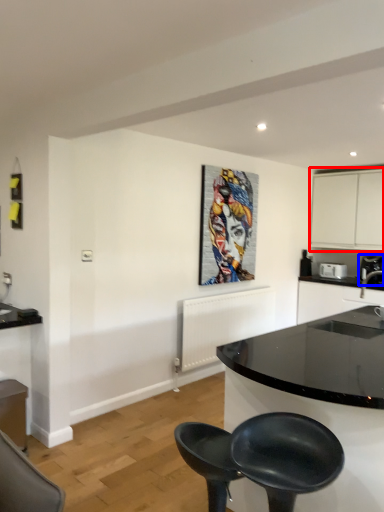
Question: Which object appears closest to the camera in this image, cabinetry (highlighted by a red box) or coffee machine (highlighted by a blue box)?

Choices:
 (A) cabinetry
 (B) coffee machine

Answer: (B)